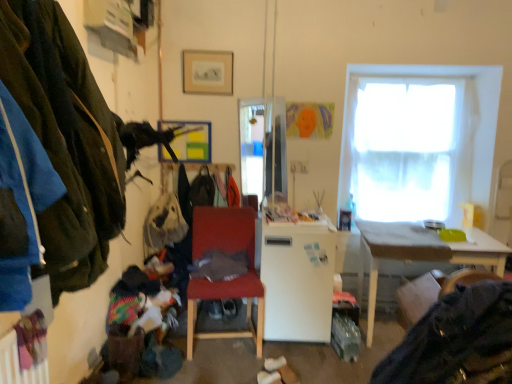
Question: Considering the relative sizes of matte gold picture frame at upper center, the 1th picture frame from the top, and velvet-like brown swivel chair at lower right in the image provided, is matte gold picture frame at upper center, the 1th picture frame from the top, wider than velvet-like brown swivel chair at lower right?

Choices:
 (A) no
 (B) yes

Answer: (A)

Question: Could velvet-like brown swivel chair at lower right be considered to be inside matte gold picture frame at upper center, placed as the second picture frame when sorted from bottom to top?

Choices:
 (A) yes
 (B) no

Answer: (B)

Question: Could you tell me if matte gold picture frame at upper center, which ranks as the first picture frame in front-to-back order, is turned towards velvet-like brown swivel chair at lower right?

Choices:
 (A) no
 (B) yes

Answer: (A)

Question: From the image's perspective, does matte gold picture frame at upper center, the 1th picture frame from the top, appear lower than velvet-like brown swivel chair at lower right?

Choices:
 (A) yes
 (B) no

Answer: (B)

Question: Does matte gold picture frame at upper center, placed as the second picture frame when sorted from bottom to top, come in front of velvet-like brown swivel chair at lower right?

Choices:
 (A) no
 (B) yes

Answer: (A)

Question: From a real-world perspective, does matte gold picture frame at upper center, which ranks as the first picture frame in front-to-back order, stand above velvet-like brown swivel chair at lower right?

Choices:
 (A) yes
 (B) no

Answer: (A)

Question: From a real-world perspective, is matte gold picture frame at upper center, the 2th picture frame positioned from the back, physically below metallic silver picture frame at upper center, positioned as the second picture frame in front-to-back order?

Choices:
 (A) yes
 (B) no

Answer: (B)

Question: Is matte gold picture frame at upper center, the 1th picture frame from the top, facing towards metallic silver picture frame at upper center, the first picture frame positioned from the bottom?

Choices:
 (A) yes
 (B) no

Answer: (B)

Question: Considering the relative sizes of matte gold picture frame at upper center, which ranks as the first picture frame in front-to-back order, and metallic silver picture frame at upper center, positioned as the second picture frame in front-to-back order, in the image provided, is matte gold picture frame at upper center, which ranks as the first picture frame in front-to-back order, bigger than metallic silver picture frame at upper center, positioned as the second picture frame in front-to-back order,?

Choices:
 (A) yes
 (B) no

Answer: (B)

Question: Are matte gold picture frame at upper center, placed as the second picture frame when sorted from bottom to top, and metallic silver picture frame at upper center, acting as the first picture frame starting from the back, far apart?

Choices:
 (A) yes
 (B) no

Answer: (B)

Question: Is matte gold picture frame at upper center, the 1th picture frame from the top, not within metallic silver picture frame at upper center, acting as the first picture frame starting from the back?

Choices:
 (A) yes
 (B) no

Answer: (A)

Question: Is matte gold picture frame at upper center, which ranks as the first picture frame in front-to-back order, positioned behind metallic silver picture frame at upper center, which is the second picture frame from top to bottom?

Choices:
 (A) no
 (B) yes

Answer: (A)

Question: Is metallic silver picture frame at upper center, acting as the first picture frame starting from the back, at the left side of white matte refrigerator at center?

Choices:
 (A) no
 (B) yes

Answer: (B)